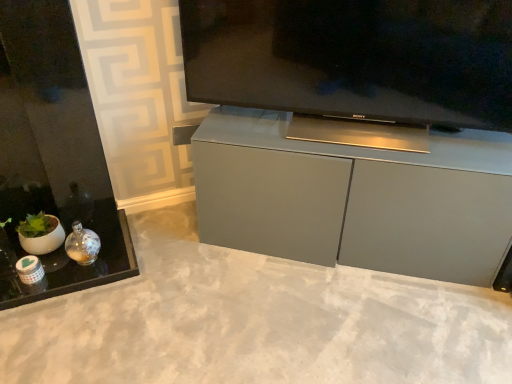
Question: Is matte gray concrete at center next to satin silver television at center?

Choices:
 (A) yes
 (B) no

Answer: (B)

Question: Does matte gray concrete at center have a greater width compared to satin silver television at center?

Choices:
 (A) yes
 (B) no

Answer: (A)

Question: Is matte gray concrete at center not close to satin silver television at center?

Choices:
 (A) no
 (B) yes

Answer: (A)

Question: Considering the relative sizes of matte gray concrete at center and satin silver television at center in the image provided, is matte gray concrete at center bigger than satin silver television at center?

Choices:
 (A) no
 (B) yes

Answer: (A)

Question: Considering the relative positions of matte gray concrete at center and satin silver television at center in the image provided, is matte gray concrete at center to the right of satin silver television at center from the viewer's perspective?

Choices:
 (A) yes
 (B) no

Answer: (B)

Question: Considering the relative positions of matte gray concrete at center and satin silver television at center in the image provided, is matte gray concrete at center in front of satin silver television at center?

Choices:
 (A) yes
 (B) no

Answer: (A)

Question: Is satin silver television at center in contact with matte gray cabinet at center?

Choices:
 (A) no
 (B) yes

Answer: (A)

Question: Is satin silver television at center wider than matte gray cabinet at center?

Choices:
 (A) yes
 (B) no

Answer: (B)

Question: Can you confirm if satin silver television at center is taller than matte gray cabinet at center?

Choices:
 (A) no
 (B) yes

Answer: (A)

Question: Does satin silver television at center have a smaller size compared to matte gray cabinet at center?

Choices:
 (A) yes
 (B) no

Answer: (A)

Question: Is matte gray cabinet at center surrounded by satin silver television at center?

Choices:
 (A) yes
 (B) no

Answer: (B)

Question: From the image's perspective, is satin silver television at center on top of matte gray cabinet at center?

Choices:
 (A) yes
 (B) no

Answer: (A)

Question: Can you confirm if matte gray cabinet at center is wider than matte gray concrete at center?

Choices:
 (A) no
 (B) yes

Answer: (A)